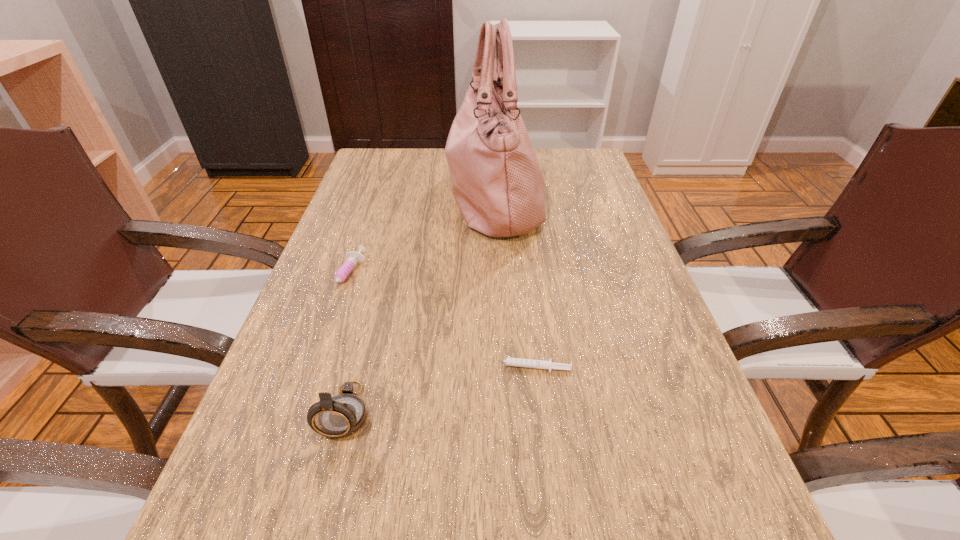
The height and width of the screenshot is (540, 960). Identify the location of handbag. [498, 186].

Locate an element on the screen. the farthest object is located at coordinates (498, 186).

Locate an element on the screen. Image resolution: width=960 pixels, height=540 pixels. the nearest object is located at coordinates (340, 416).

Image resolution: width=960 pixels, height=540 pixels. Identify the location of the second tallest object. (340, 416).

Locate an element on the screen. the leftmost object is located at coordinates (354, 258).

What are the coordinates of `the second farthest object` in the screenshot? It's located at (354, 258).

You are a GUI agent. You are given a task and a screenshot of the screen. Output one action in this format:
    pyautogui.click(x=<x>, y=<y>)
    Task: Click on the nearer syringe
    The image size is (960, 540).
    Given the screenshot: What is the action you would take?
    pyautogui.click(x=516, y=362)

You are a GUI agent. You are given a task and a screenshot of the screen. Output one action in this format:
    pyautogui.click(x=<x>, y=<y>)
    Task: Click on the second nearest object
    
    Given the screenshot: What is the action you would take?
    tap(516, 362)

The height and width of the screenshot is (540, 960). What are the coordinates of `free space located at the front of the tallest object with handles` in the screenshot? It's located at (378, 196).

Where is `free space located at the front of the tallest object with handles`? Image resolution: width=960 pixels, height=540 pixels. free space located at the front of the tallest object with handles is located at coordinates (425, 196).